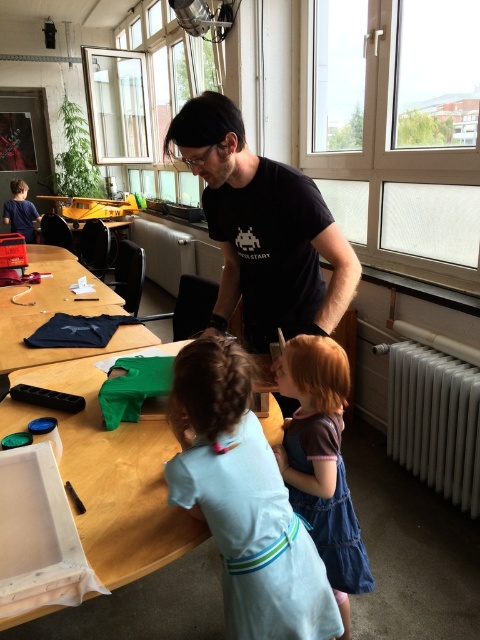
In the scene shown: Is light blue fabric at center taller than wooden table at center?

Correct, light blue fabric at center is much taller as wooden table at center.

Is light blue fabric at center bigger than wooden table at center?

No, light blue fabric at center is not bigger than wooden table at center.

This screenshot has height=640, width=480. I want to click on light blue fabric at center, so click(243, 500).

Between point (247, 515) and point (470, 381), which one is positioned in front?

Point (247, 515)

Is point (203, 429) less distant than point (432, 360)?

Yes, point (203, 429) is closer to viewer.

Locate an element on the screen. The image size is (480, 640). light blue fabric at center is located at coordinates (243, 500).

Is black matte t-shirt at center shorter than white metallic radiator at lower right?

In fact, black matte t-shirt at center may be taller than white metallic radiator at lower right.

Can you confirm if black matte t-shirt at center is taller than white metallic radiator at lower right?

Correct, black matte t-shirt at center is much taller as white metallic radiator at lower right.

You are a GUI agent. You are given a task and a screenshot of the screen. Output one action in this format:
    pyautogui.click(x=<x>, y=<y>)
    Task: Click on the black matte t-shirt at center
    The height and width of the screenshot is (640, 480).
    Given the screenshot: What is the action you would take?
    pyautogui.click(x=263, y=228)